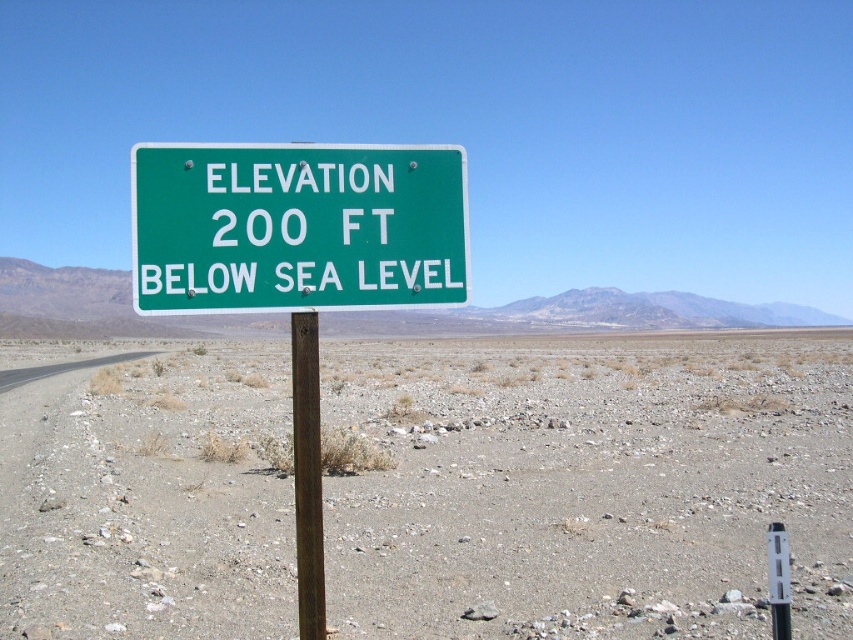
Question: Can you confirm if green metal sign at center is positioned to the right of brown wooden post at center?

Choices:
 (A) yes
 (B) no

Answer: (A)

Question: Which of the following is the closest to the observer?

Choices:
 (A) (245, 177)
 (B) (764, 365)
 (C) (308, 342)

Answer: (C)

Question: Is green metal sign at center positioned behind brown wooden post at center?

Choices:
 (A) no
 (B) yes

Answer: (B)

Question: Which object is the closest to the brown wooden post at center?

Choices:
 (A) gray gravel desert at center
 (B) green metal sign at center

Answer: (B)

Question: Is gray gravel desert at center smaller than brown wooden post at center?

Choices:
 (A) no
 (B) yes

Answer: (A)

Question: Among these objects, which one is farthest from the camera?

Choices:
 (A) brown wooden post at center
 (B) green metal sign at center

Answer: (B)